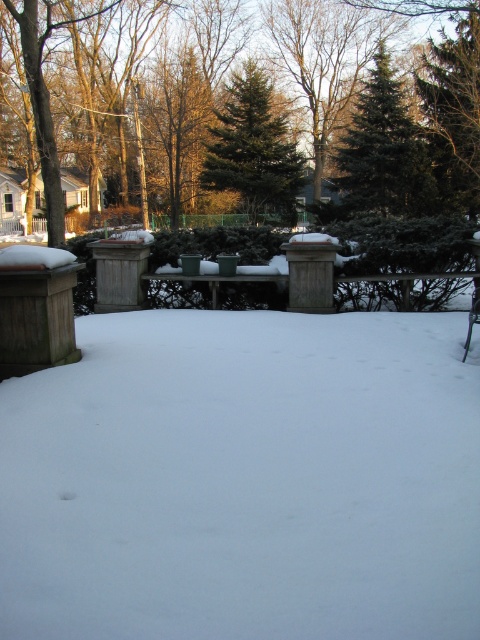
Can you confirm if green evergreen tree at center is shorter than green fir tree at upper center?

No.

Locate an element on the screen. The image size is (480, 640). green evergreen tree at center is located at coordinates (249, 106).

Looking at this image, does green evergreen tree at center appear over green textured evergreen tree at center?

No.

Between green evergreen tree at center and green textured evergreen tree at center, which one appears on the left side from the viewer's perspective?

green evergreen tree at center is more to the left.

Between point (107, 68) and point (298, 164), which one is positioned behind?

The point (107, 68) is behind.

Identify the location of green evergreen tree at center. (249, 106).

How far apart are white fluffy snow at center and green textured evergreen tree at center?

white fluffy snow at center is 72.56 feet from green textured evergreen tree at center.

Can you confirm if white fluffy snow at center is bigger than green textured evergreen tree at center?

No, white fluffy snow at center is not bigger than green textured evergreen tree at center.

Looking at this image, who is more distant from viewer, (6,541) or (253,160)?

Point (253,160)

Identify the location of white fluffy snow at center. (244, 480).